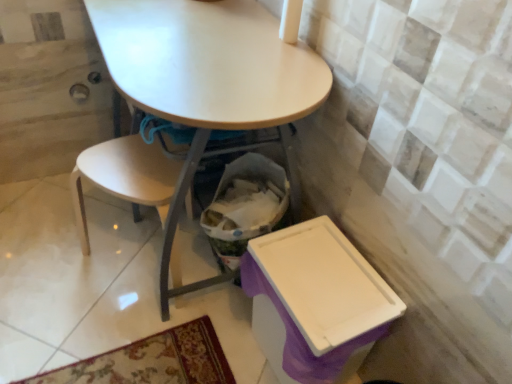
Find the location of a particular element. The image size is (512, 384). vacant area situated to the left side of light wood chair at lower left is located at coordinates (50, 246).